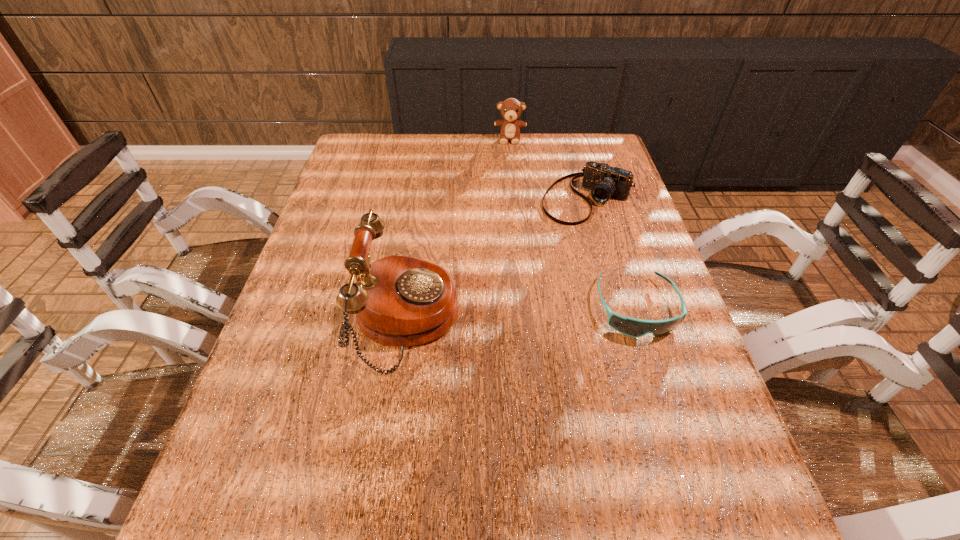
Where is `the leftmost object`? This screenshot has width=960, height=540. the leftmost object is located at coordinates (400, 301).

Where is `the tallest object`? the tallest object is located at coordinates (400, 301).

Locate an element on the screen. sunglasses is located at coordinates (633, 327).

You are a GUI agent. You are given a task and a screenshot of the screen. Output one action in this format:
    pyautogui.click(x=<x>, y=<y>)
    Task: Click on the second shortest object
    
    Given the screenshot: What is the action you would take?
    pyautogui.click(x=604, y=181)

Identify the location of the third nearest object. Image resolution: width=960 pixels, height=540 pixels. (604, 181).

Identify the location of teddy bear. (511, 109).

Locate an element on the screen. This screenshot has width=960, height=540. the second object from left to right is located at coordinates (511, 109).

You are a GUI agent. You are given a task and a screenshot of the screen. Output one action in this format:
    pyautogui.click(x=<x>, y=<y>)
    Task: Click on the free space located 0.390m on the dial of the tallest object
    Image resolution: width=960 pixels, height=540 pixels.
    Given the screenshot: What is the action you would take?
    pyautogui.click(x=633, y=319)

The width and height of the screenshot is (960, 540). Identify the location of free region located 0.210m on the front-facing side of the shortest object. (678, 437).

At what (x,y) coordinates should I click in order to perform the action: click on blank space located 0.080m on the front-facing side of the camera. Please return your answer as a coordinate pair (x, y). The width and height of the screenshot is (960, 540). Looking at the image, I should click on (553, 237).